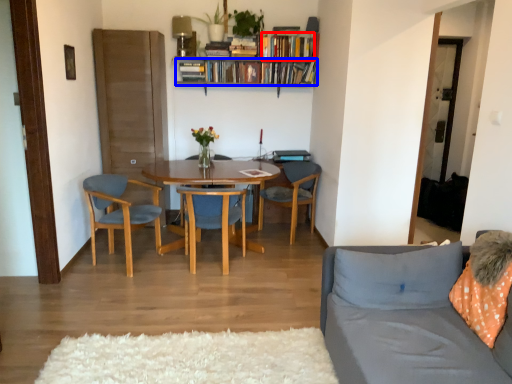
Question: Which object appears closest to the camera in this image, book (highlighted by a red box) or book (highlighted by a blue box)?

Choices:
 (A) book
 (B) book

Answer: (A)